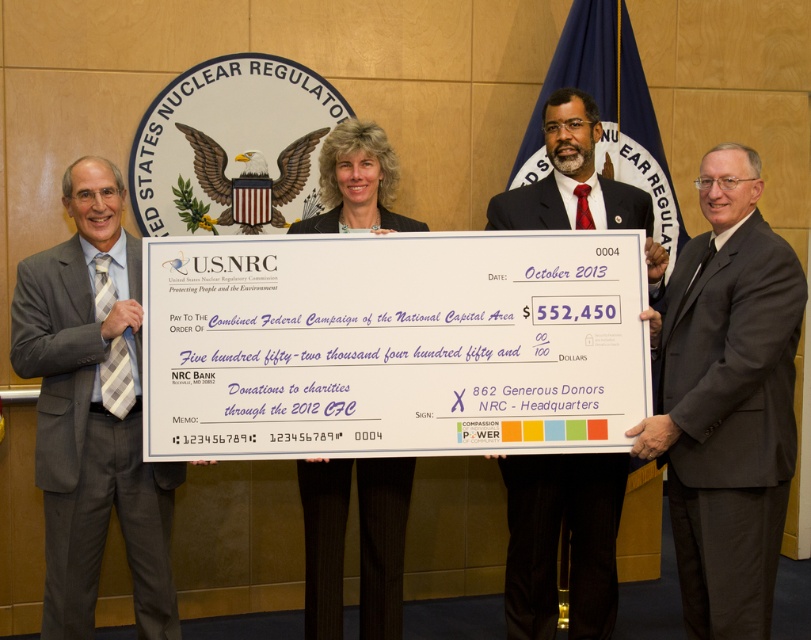
In the scene shown: You are attending a formal event and notice two individuals in the image. One is wearing a gray suit at left and the other a dark suit at center. From your perspective, which individual is positioned to the left of the other?

The gray suit at left is positioned to the left of the dark suit at center.

You are standing in front of the U.S. NRC seal backdrop and want to place a small decoration on one of the two points marked in the image. Which point, point 1 at coordinates (139,460) or point 2 at coordinates (372,195), is closer to you so the decoration will be more visible?

Point 1 at coordinates (139,460) is closer to the viewer than point 2 at coordinates (372,195), so placing the decoration there would make it more visible.